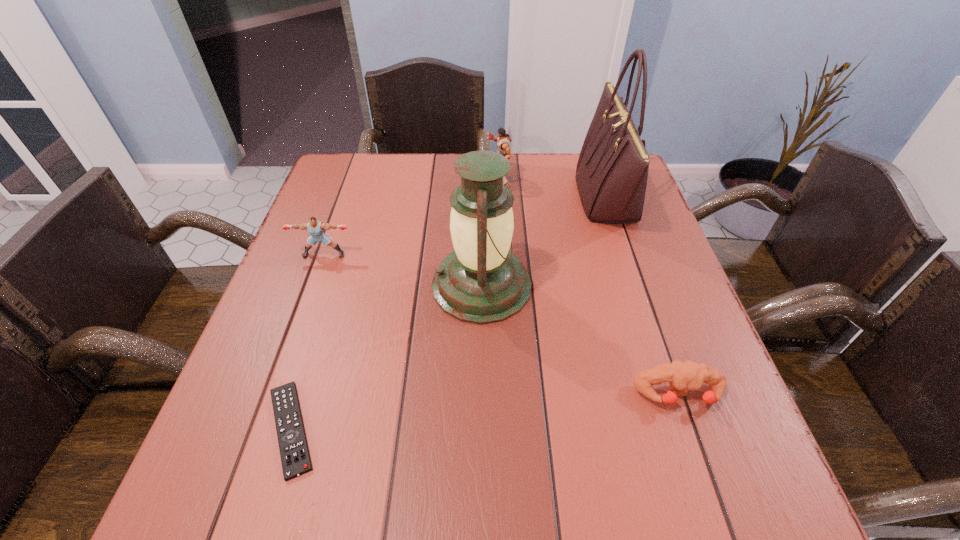
Identify which puncher is located as the nearest to the lantern. Please provide its 2D coordinates. Your answer should be formatted as a tuple, i.e. [(x, y)], where the tuple contains the x and y coordinates of a point satisfying the conditions above.

[(315, 228)]

Select which puncher is the closest to the tallest object. Please provide its 2D coordinates. Your answer should be formatted as a tuple, i.e. [(x, y)], where the tuple contains the x and y coordinates of a point satisfying the conditions above.

[(503, 141)]

The width and height of the screenshot is (960, 540). I want to click on blank space that satisfies the following two spatial constraints: 1. on the front-facing side of the tallest puncher; 2. on the front-facing side of the leftmost puncher, so pos(502,254).